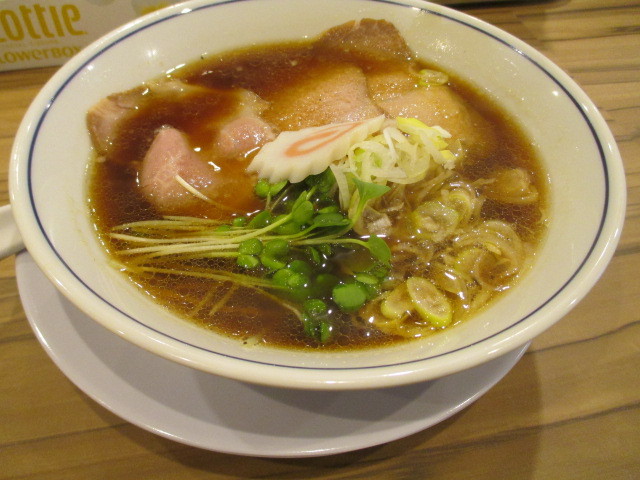
In order to click on bowl in this screenshot , I will do `click(502, 89)`.